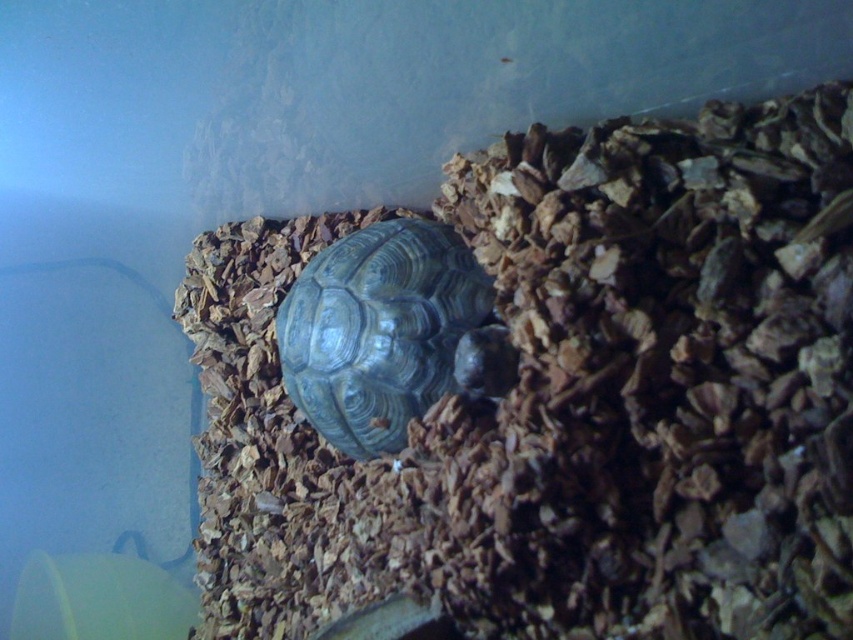
You are a caretaker checking the enclosure of a tortoise. You notice the shiny dark gray tortoise at center and the brown wood chips at center. Which object is positioned to the left of the other?

The brown wood chips at center are to the left of the shiny dark gray tortoise at center.

You are a caretaker checking the enclosure of a tortoise. You need to place a small food bowl in an area that is not covered by the brown wood chips at center. Based on the coordinates provided, where should you place the bowl?

The brown wood chips at center are located at point (566, 400). To avoid placing the food bowl on them, you should position it away from that coordinate, perhaps towards the edges of the enclosure where there are no wood chips.

You are a vet examining the enclosure of a tortoise. You see the brown wood chips at center and the shiny dark gray tortoise at center. Which object is taller?

The brown wood chips at center are much taller than the shiny dark gray tortoise at center.